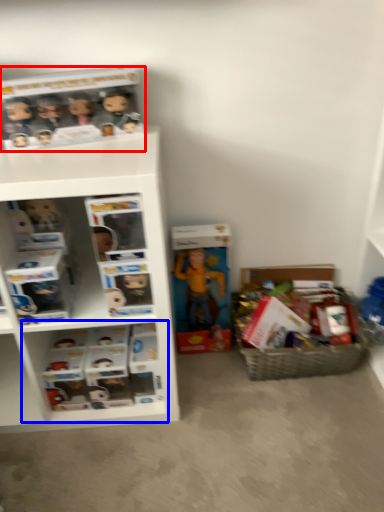
Question: Which point is closer to the camera, collection (highlighted by a red box) or cabinet (highlighted by a blue box)?

Choices:
 (A) collection
 (B) cabinet

Answer: (A)